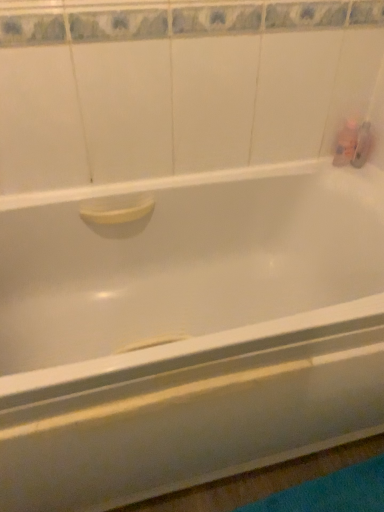
Question: Does translucent plastic bottle at upper right, the 1th toiletry viewed from the left, have a larger size compared to translucent plastic soap at upper right, which is the 1th toiletry in right-to-left order?

Choices:
 (A) yes
 (B) no

Answer: (A)

Question: Is translucent plastic bottle at upper right, which is the second toiletry in right-to-left order, positioned behind translucent plastic soap at upper right, which ranks as the second toiletry in left-to-right order?

Choices:
 (A) yes
 (B) no

Answer: (B)

Question: Could you tell me if translucent plastic bottle at upper right, the 1th toiletry viewed from the left, is turned towards translucent plastic soap at upper right, which is the 1th toiletry in right-to-left order?

Choices:
 (A) no
 (B) yes

Answer: (A)

Question: Considering the relative sizes of translucent plastic bottle at upper right, which is the second toiletry in right-to-left order, and translucent plastic soap at upper right, which ranks as the second toiletry in left-to-right order, in the image provided, is translucent plastic bottle at upper right, which is the second toiletry in right-to-left order, taller than translucent plastic soap at upper right, which ranks as the second toiletry in left-to-right order,?

Choices:
 (A) yes
 (B) no

Answer: (A)

Question: Is translucent plastic bottle at upper right, which is the second toiletry in right-to-left order, oriented away from translucent plastic soap at upper right, which ranks as the second toiletry in left-to-right order?

Choices:
 (A) yes
 (B) no

Answer: (B)

Question: Is translucent plastic bottle at upper right, the 1th toiletry viewed from the left, closer to camera compared to translucent plastic soap at upper right, which ranks as the second toiletry in left-to-right order?

Choices:
 (A) no
 (B) yes

Answer: (B)

Question: From a real-world perspective, is translucent plastic soap at upper right, which is the 1th toiletry in right-to-left order, on translucent plastic bottle at upper right, which is the second toiletry in right-to-left order?

Choices:
 (A) yes
 (B) no

Answer: (B)

Question: Is translucent plastic soap at upper right, which ranks as the second toiletry in left-to-right order, outside of translucent plastic bottle at upper right, the 1th toiletry viewed from the left?

Choices:
 (A) no
 (B) yes

Answer: (B)

Question: Is translucent plastic soap at upper right, which ranks as the second toiletry in left-to-right order, oriented towards translucent plastic bottle at upper right, which is the second toiletry in right-to-left order?

Choices:
 (A) yes
 (B) no

Answer: (B)

Question: Does translucent plastic soap at upper right, which is the 1th toiletry in right-to-left order, have a lesser height compared to translucent plastic bottle at upper right, which is the second toiletry in right-to-left order?

Choices:
 (A) yes
 (B) no

Answer: (A)

Question: Is translucent plastic soap at upper right, which is the 1th toiletry in right-to-left order, far away from translucent plastic bottle at upper right, which is the second toiletry in right-to-left order?

Choices:
 (A) yes
 (B) no

Answer: (B)

Question: From the image's perspective, would you say translucent plastic soap at upper right, which is the 1th toiletry in right-to-left order, is shown under translucent plastic bottle at upper right, the 1th toiletry viewed from the left?

Choices:
 (A) yes
 (B) no

Answer: (B)

Question: In the image, is translucent plastic bottle at upper right, which is the second toiletry in right-to-left order, positioned in front of or behind translucent plastic soap at upper right, which ranks as the second toiletry in left-to-right order?

Choices:
 (A) behind
 (B) front

Answer: (B)